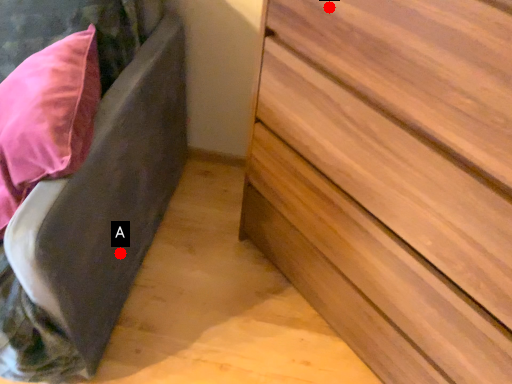
Question: Two points are circled on the image, labeled by A and B beside each circle. Which of the following is the farthest from the observer?

Choices:
 (A) A is further
 (B) B is further

Answer: (A)